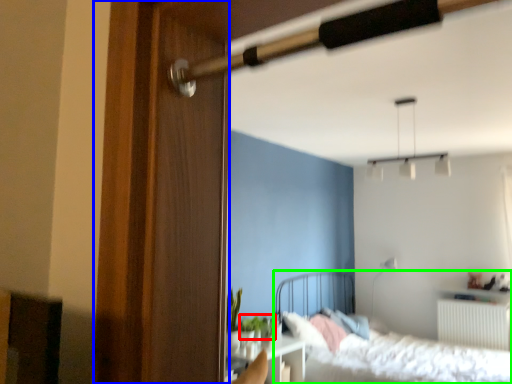
Question: Which object is positioned farthest from plant (highlighted by a red box)? Select from screen door (highlighted by a blue box) and bed (highlighted by a green box).

Choices:
 (A) screen door
 (B) bed

Answer: (A)